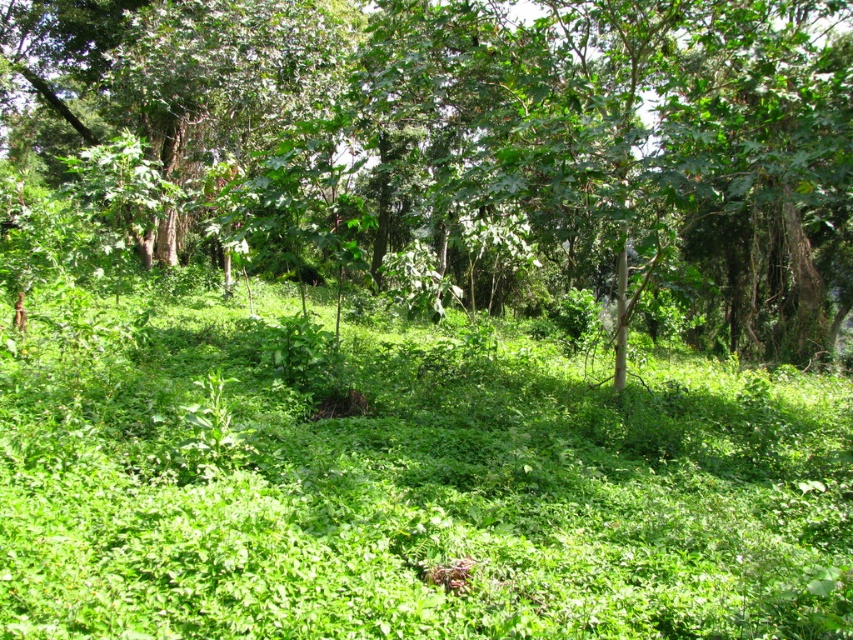
In the scene shown: Can you confirm if green leafy grass at center is wider than green leafy tree at center?

In fact, green leafy grass at center might be narrower than green leafy tree at center.

Which is above, green leafy grass at center or green leafy tree at center?

Positioned higher is green leafy tree at center.

Describe the element at coordinates (404, 483) in the screenshot. This screenshot has height=640, width=853. I see `green leafy grass at center` at that location.

Image resolution: width=853 pixels, height=640 pixels. In order to click on green leafy grass at center in this screenshot , I will do `click(404, 483)`.